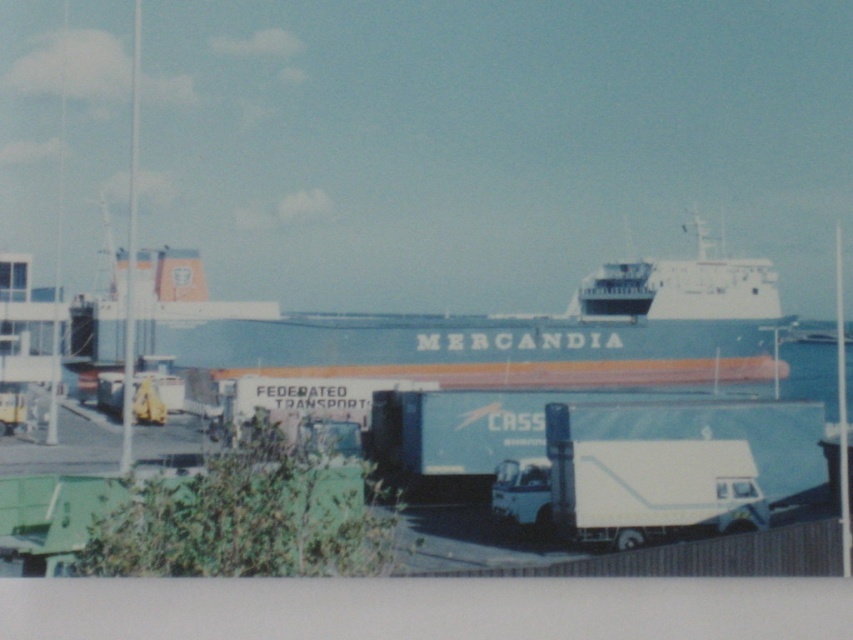
You are a crane operator at the port. You need to load containers onto the white matte ship at center and the white matte trailer truck at center. Which one requires a larger crane to handle the containers?

The white matte ship at center is bigger than the white matte trailer truck at center, so it requires a larger crane to handle the containers.

You are standing at the dock and want to reach the point at coordinates (654,284). If your walking speed is 3 feet per second, how long will it take you to reach that point?

The distance to the point at coordinates (654,284) is 513.23 feet. At a walking speed of 3 feet per second, it will take approximately 171 seconds, which is 2 minutes and 51 seconds, to reach the point.